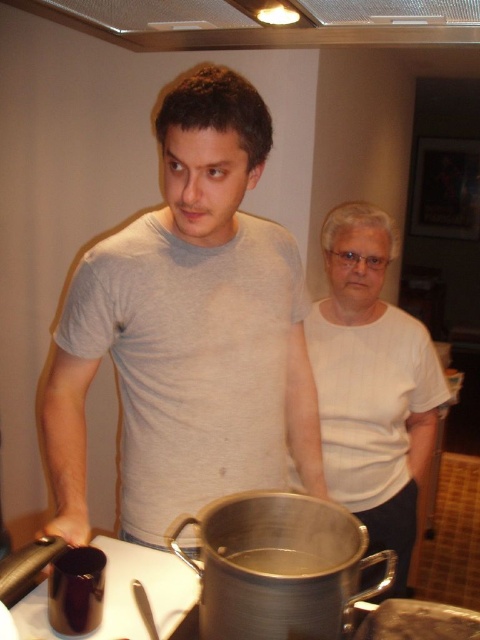
You are a chef preparing a dish and need to place a rectangular cutting board between the white matte shirt at center and the metallic silver pot at center on the counter. Can the cutting board fit horizontally between them if it is 30 cm wide?

The white matte shirt at center is wider than the metallic silver pot at center. However, the exact distance between them isn not specified in the objects description. Without knowing the space between the two objects, it is impossible to determine if the cutting board can fit horizontally.

Please describe the position of the white matte shirt at center in terms of its coordinates on the image plane. The image plane has its origin at the bottom left corner, with the x and y axes increasing to the right and upwards respectively. The coordinates are normalized between 0 and 1. Please provide the coordinates as an ordered pair in parentheses, separated by a comma, without any units.

The white matte shirt at center is located at coordinates point (372,384).